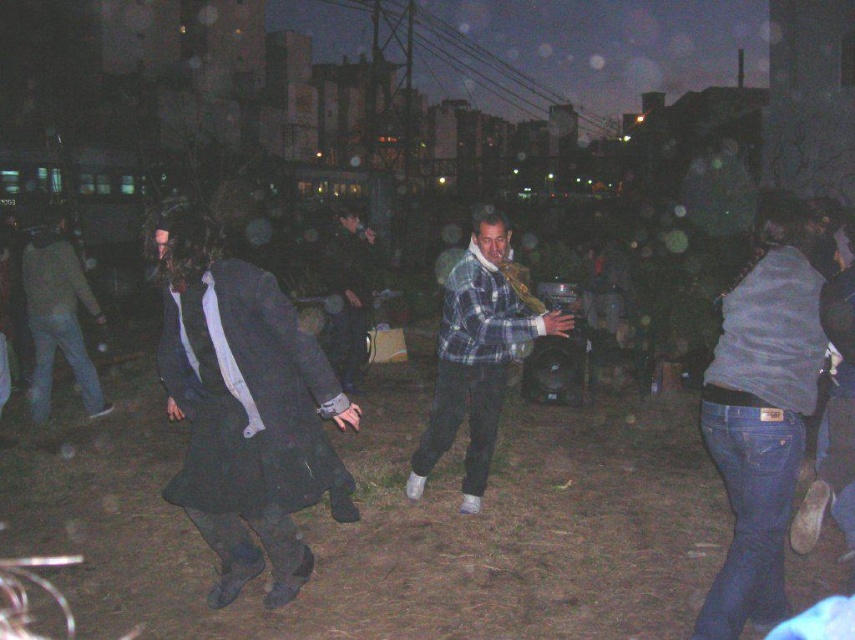
Which of these two, dark gray coat at center or dark gray flannel shirt at center, stands taller?

dark gray flannel shirt at center

This screenshot has width=855, height=640. What do you see at coordinates (57, 316) in the screenshot?
I see `dark gray coat at center` at bounding box center [57, 316].

Locate an element on the screen. Image resolution: width=855 pixels, height=640 pixels. dark gray coat at center is located at coordinates (57, 316).

Who is shorter, plaid flannel shirt at center or dark gray coat at center?

Standing shorter between the two is dark gray coat at center.

Does point (481, 392) come closer to viewer compared to point (84, 280)?

Yes, it is in front of point (84, 280).

Where is `plaid flannel shirt at center`? The image size is (855, 640). plaid flannel shirt at center is located at coordinates (476, 356).

Which is behind, point (445, 442) or point (332, 348)?

The point (332, 348) is behind.

Between plaid flannel shirt at center and dark gray flannel shirt at center, which one is positioned higher?

dark gray flannel shirt at center is higher up.

Measure the distance between plaid flannel shirt at center and camera.

The distance of plaid flannel shirt at center from camera is 4.78 meters.

Where is `plaid flannel shirt at center`? plaid flannel shirt at center is located at coordinates (476, 356).